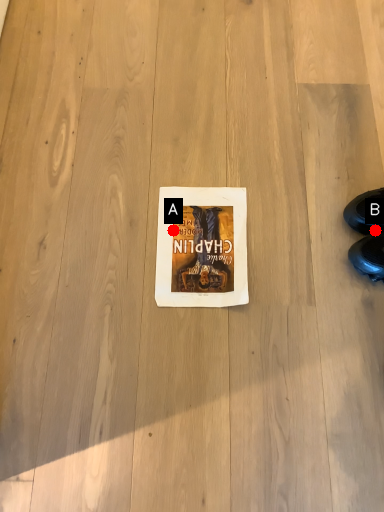
Question: Two points are circled on the image, labeled by A and B beside each circle. Which point appears closest to the camera in this image?

Choices:
 (A) A is closer
 (B) B is closer

Answer: (B)